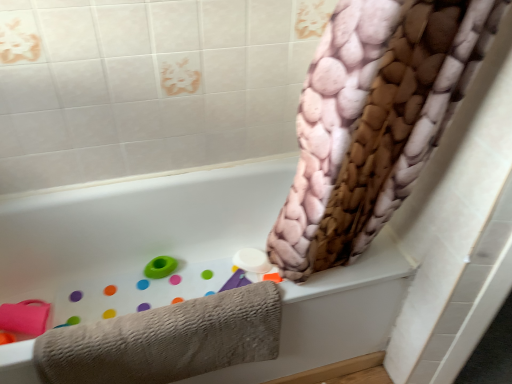
This screenshot has width=512, height=384. Identify the location of white matte bathtub at upper center. (136, 233).

Locate an element on the screen. The height and width of the screenshot is (384, 512). green rubber ring at lower left is located at coordinates (160, 267).

Between point (227, 366) and point (159, 261), which one is positioned behind?

The point (159, 261) is behind.

Is there a large distance between beige textured towel at lower left and green rubber ring at lower left?

No, beige textured towel at lower left is not far away from green rubber ring at lower left.

Is beige textured towel at lower left behind green rubber ring at lower left?

That is False.

Is beige textured towel at lower left at the left side of green rubber ring at lower left?

No, beige textured towel at lower left is not to the left of green rubber ring at lower left.

Could you tell me if green rubber ring at lower left is turned towards white matte bathtub at upper center?

Yes.

Is point (150, 270) behind point (180, 226)?

That is False.

Considering the relative sizes of green rubber ring at lower left and white matte bathtub at upper center in the image provided, is green rubber ring at lower left taller than white matte bathtub at upper center?

Incorrect, the height of green rubber ring at lower left is not larger of that of white matte bathtub at upper center.

Which is in front, green rubber ring at lower left or white matte bathtub at upper center?

white matte bathtub at upper center.

Based on the photo, are green rubber ring at lower left and beige textured towel at lower left making contact?

green rubber ring at lower left and beige textured towel at lower left are clearly separated.

From the picture: Can you confirm if green rubber ring at lower left is taller than beige textured towel at lower left?

No, green rubber ring at lower left is not taller than beige textured towel at lower left.

How much distance is there between green rubber ring at lower left and beige textured towel at lower left?

green rubber ring at lower left and beige textured towel at lower left are 22.69 inches apart.

From a real-world perspective, is green rubber ring at lower left physically below beige textured towel at lower left?

Correct, in the physical world, green rubber ring at lower left is lower than beige textured towel at lower left.

Is beige textured towel at lower left to the left of white matte bathtub at upper center from the viewer's perspective?

No, beige textured towel at lower left is not to the left of white matte bathtub at upper center.

From the image's perspective, would you say beige textured towel at lower left is shown under white matte bathtub at upper center?

Yes, from the image's perspective, beige textured towel at lower left is beneath white matte bathtub at upper center.

In terms of size, does beige textured towel at lower left appear bigger or smaller than white matte bathtub at upper center?

In the image, beige textured towel at lower left appears to be smaller than white matte bathtub at upper center.

Can you tell me how much beige textured towel at lower left and white matte bathtub at upper center differ in facing direction?

The facing directions of beige textured towel at lower left and white matte bathtub at upper center are 2.61e-05 degrees apart.

From the image's perspective, which is below, white matte bathtub at upper center or green rubber ring at lower left?

From the image's view, white matte bathtub at upper center is below.

How many degrees apart are the facing directions of white matte bathtub at upper center and green rubber ring at lower left?

white matte bathtub at upper center and green rubber ring at lower left are facing 3.55e-05 degrees away from each other.

From their relative heights in the image, would you say white matte bathtub at upper center is taller or shorter than green rubber ring at lower left?

Considering their sizes, white matte bathtub at upper center has more height than green rubber ring at lower left.

Considering the positions of objects white matte bathtub at upper center and green rubber ring at lower left in the image provided, who is more to the right, white matte bathtub at upper center or green rubber ring at lower left?

Positioned to the right is white matte bathtub at upper center.

Between white matte bathtub at upper center and beige textured towel at lower left, which one has more height?

Standing taller between the two is white matte bathtub at upper center.

Where is `towel above the white matte bathtub at upper center (from a real-world perspective)`? towel above the white matte bathtub at upper center (from a real-world perspective) is located at coordinates (166, 340).

Is white matte bathtub at upper center positioned with its back to beige textured towel at lower left?

Yes.

Is white matte bathtub at upper center in front of beige textured towel at lower left?

Yes, it is.

This screenshot has width=512, height=384. I want to click on towel above the green rubber ring at lower left (from a real-world perspective), so click(x=166, y=340).

Image resolution: width=512 pixels, height=384 pixels. Identify the location of toy behind the white matte bathtub at upper center. (160, 267).

Considering their positions, is beige textured towel at lower left positioned further to green rubber ring at lower left than white matte bathtub at upper center?

Among the two, beige textured towel at lower left is located further to green rubber ring at lower left.

Based on the photo, from the image, which object appears to be farther from white matte bathtub at upper center, beige textured towel at lower left or green rubber ring at lower left?

beige textured towel at lower left lies further to white matte bathtub at upper center than the other object.

Estimate the real-world distances between objects in this image. Which object is closer to beige textured towel at lower left, green rubber ring at lower left or white matte bathtub at upper center?

Among the two, white matte bathtub at upper center is located nearer to beige textured towel at lower left.

Based on their spatial positions, is green rubber ring at lower left or beige textured towel at lower left closer to white matte bathtub at upper center?

green rubber ring at lower left is closer to white matte bathtub at upper center.

Looking at the image, which one is located closer to beige textured towel at lower left, white matte bathtub at upper center or green rubber ring at lower left?

white matte bathtub at upper center is positioned closer to the anchor beige textured towel at lower left.

Considering their positions, is white matte bathtub at upper center positioned closer to green rubber ring at lower left than beige textured towel at lower left?

white matte bathtub at upper center lies closer to green rubber ring at lower left than the other object.

At what (x,y) coordinates should I click in order to perform the action: click on towel located between white matte bathtub at upper center and green rubber ring at lower left in the depth direction. Please return your answer as a coordinate pair (x, y). Image resolution: width=512 pixels, height=384 pixels. Looking at the image, I should click on (166, 340).